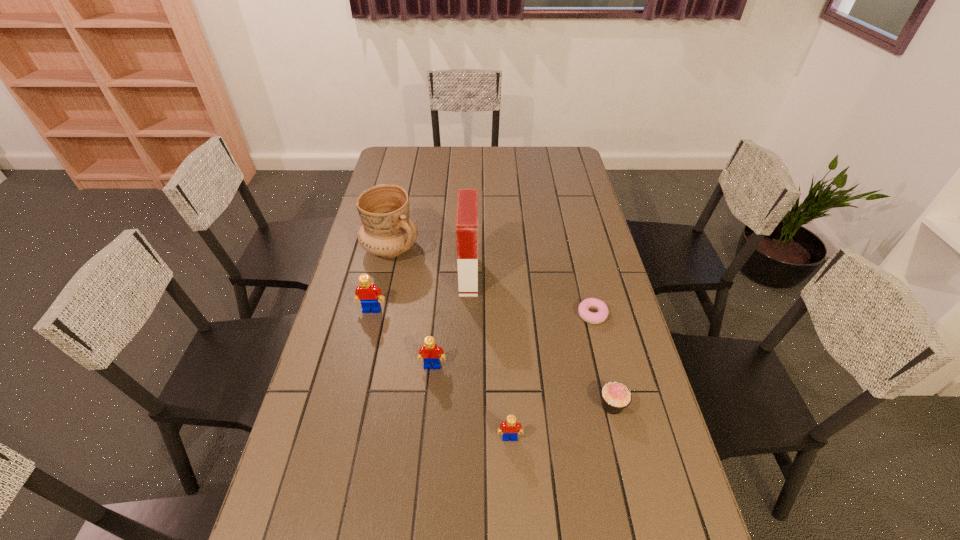
At what (x,y) coordinates should I click in order to perform the action: click on free point between the pottery and the third object from right to left. Please return your answer as a coordinate pair (x, y). The width and height of the screenshot is (960, 540). Looking at the image, I should click on (450, 343).

Where is `vacant area between the sixth farthest object and the second farthest Lego`? vacant area between the sixth farthest object and the second farthest Lego is located at coordinates (522, 386).

Find the location of a particular element. The image size is (960, 540). free spot between the second nearest object and the second tallest object is located at coordinates (501, 327).

The image size is (960, 540). In order to click on vacant space in between the rightmost Lego and the cupcake in this screenshot , I will do `click(561, 422)`.

At what (x,y) coordinates should I click in order to perform the action: click on blank region between the tallest object and the pastry. Please return your answer as a coordinate pair (x, y). Image resolution: width=960 pixels, height=540 pixels. Looking at the image, I should click on (531, 295).

Identify the location of the second closest object to the nearest Lego. (430, 352).

Select which object is the sixth closest to the second nearest object. Please provide its 2D coordinates. Your answer should be formatted as a tuple, i.e. [(x, y)], where the tuple contains the x and y coordinates of a point satisfying the conditions above.

[(387, 231)]

Identify which Lego is the second nearest to the cupcake. Please provide its 2D coordinates. Your answer should be formatted as a tuple, i.e. [(x, y)], where the tuple contains the x and y coordinates of a point satisfying the conditions above.

[(430, 352)]

Identify the location of Lego that stands as the second closest to the cupcake. (430, 352).

You are a GUI agent. You are given a task and a screenshot of the screen. Output one action in this format:
    pyautogui.click(x=<x>, y=<y>)
    Task: Click on the vacant area that satisfies the following two spatial constraints: 1. on the front-facing side of the cigarette_case; 2. on the front-facing side of the second nearest Lego
    The width and height of the screenshot is (960, 540).
    Given the screenshot: What is the action you would take?
    pyautogui.click(x=467, y=366)